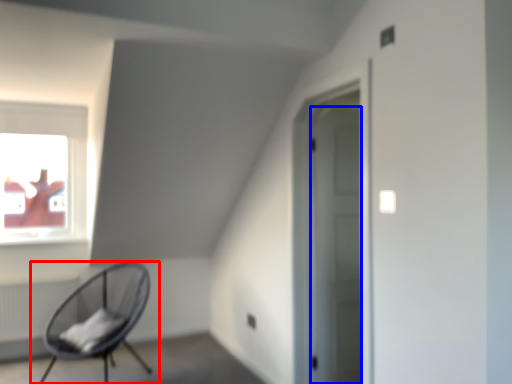
Question: Which point is further to the camera, chair (highlighted by a red box) or door (highlighted by a blue box)?

Choices:
 (A) chair
 (B) door

Answer: (B)